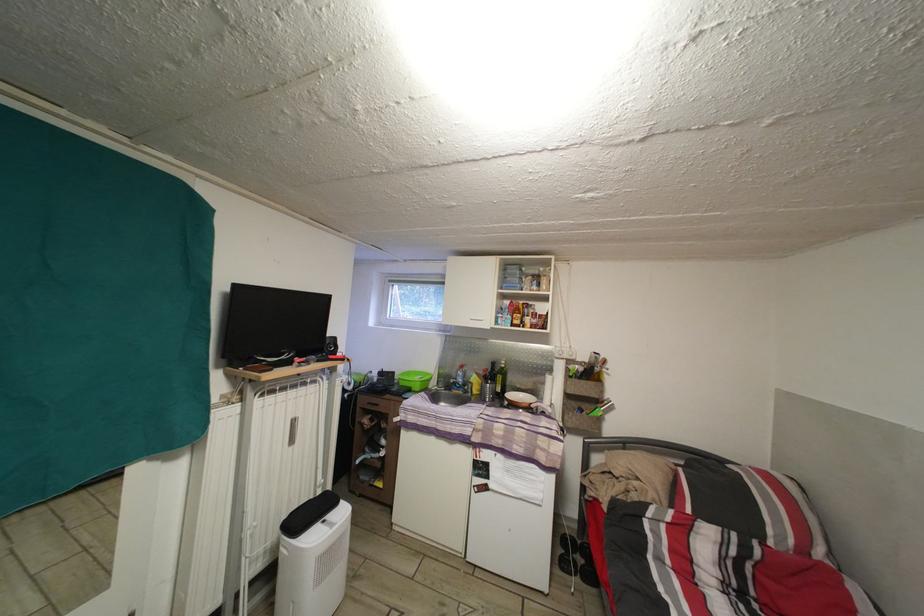
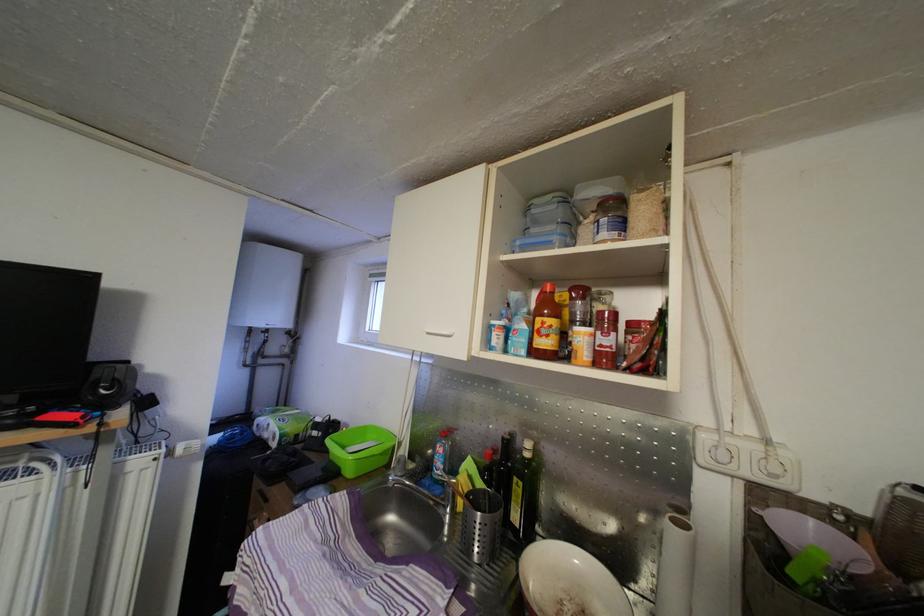
Question: In a continuous first-person perspective shot, in which direction is the camera moving?

Choices:
 (A) Left
 (B) Right
 (C) Forward
 (D) Backward

Answer: (C)